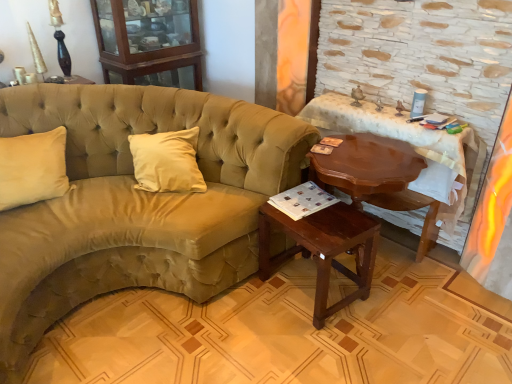
Image resolution: width=512 pixels, height=384 pixels. In order to click on vacant space in front of mahogany wood side table at lower center, the first table in the left-to-right sequence in this screenshot , I will do `click(320, 349)`.